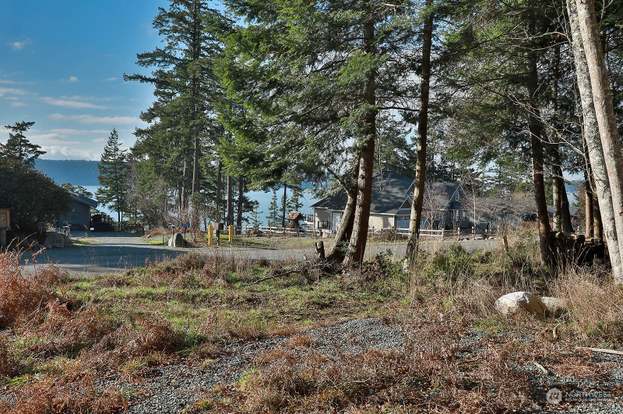
Locate an element on the screen. door is located at coordinates (335, 221).